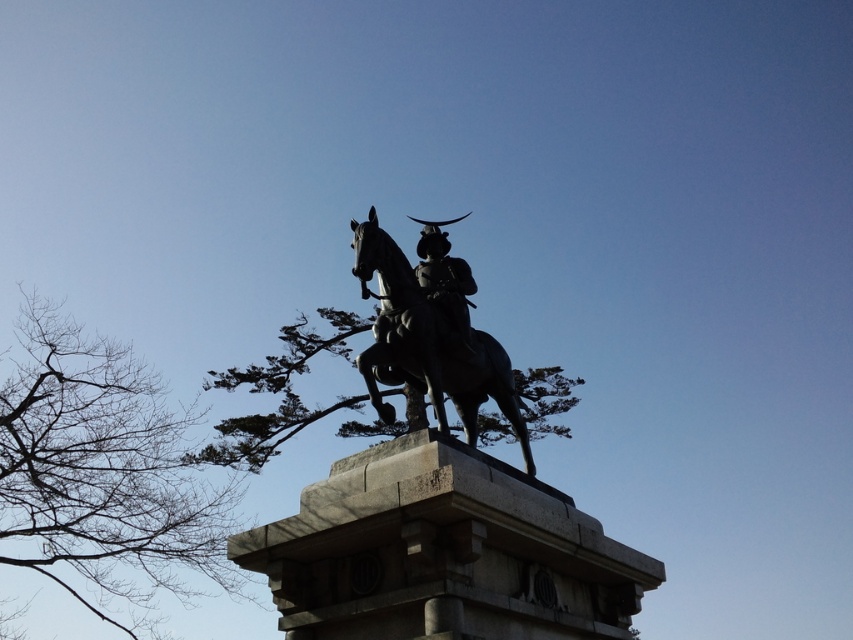
Is point (523, 636) closer to viewer compared to point (489, 371)?

Yes, point (523, 636) is closer to viewer.

Is bronze statue at center taller than bronze horse at center?

Yes, bronze statue at center is taller than bronze horse at center.

Identify the location of bronze statue at center. (439, 508).

Can you confirm if bronze statue at center is thinner than shiny bronze helmet at center?

In fact, bronze statue at center might be wider than shiny bronze helmet at center.

Measure the distance between bronze statue at center and shiny bronze helmet at center.

3.97 meters

Between point (642, 588) and point (442, 301), which one is positioned in front?

Point (642, 588)

At what (x,y) coordinates should I click in order to perform the action: click on bronze statue at center. Please return your answer as a coordinate pair (x, y). Looking at the image, I should click on (439, 508).

Who is taller, bare branches at left or shiny bronze helmet at center?

bare branches at left is taller.

The height and width of the screenshot is (640, 853). In order to click on bare branches at left in this screenshot , I will do `click(103, 472)`.

Locate an element on the screen. This screenshot has height=640, width=853. bare branches at left is located at coordinates tap(103, 472).